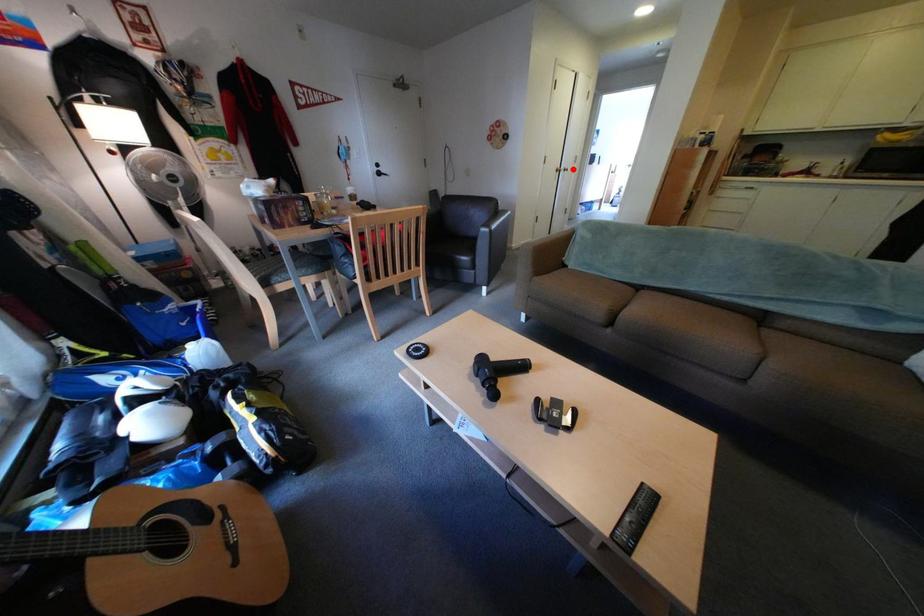
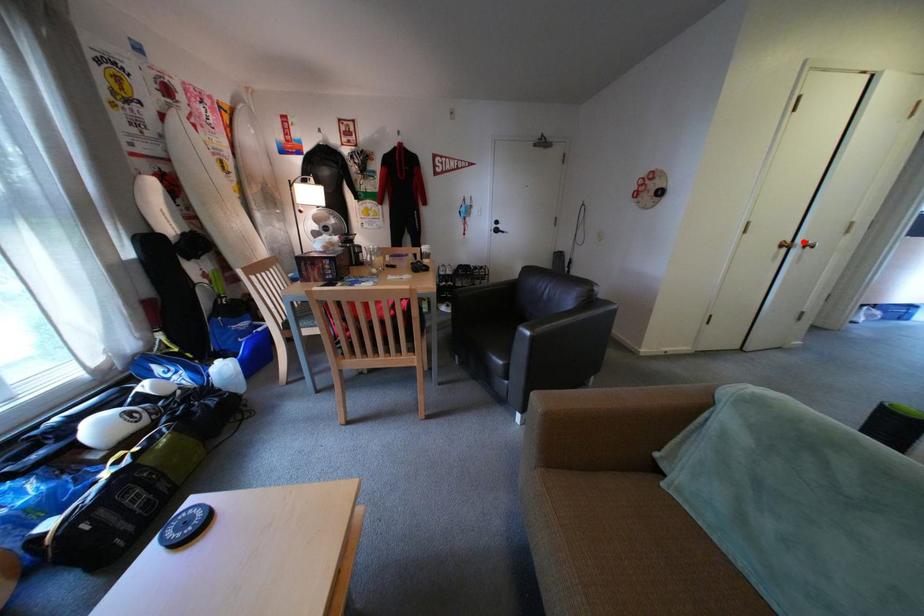
I am providing you with two images of the same scene from different viewpoints. A red point is marked on the first image and another point is marked on the second image. Is the marked point in image1 the same physical position as the marked point in image2?

Yes